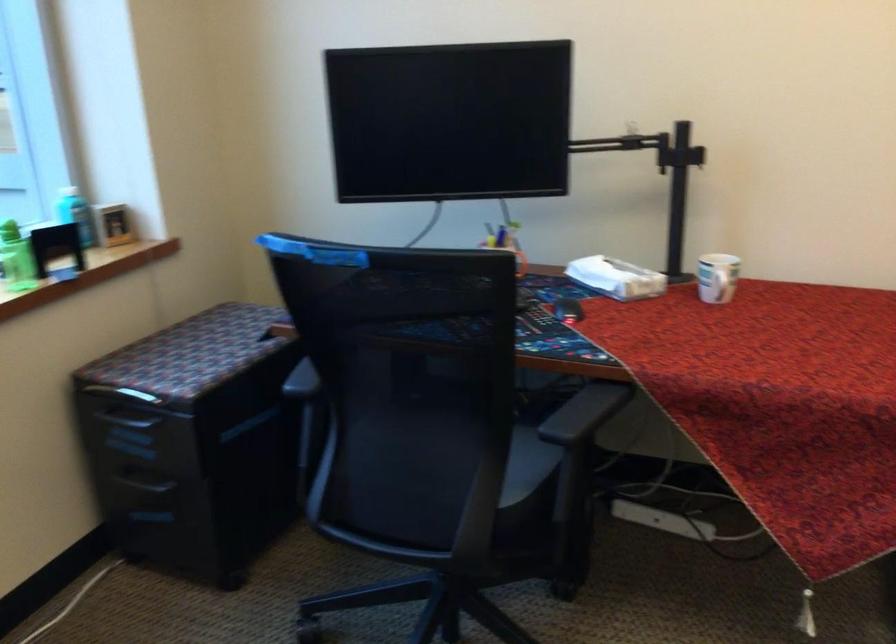
You are a GUI agent. You are given a task and a screenshot of the screen. Output one action in this format:
    pyautogui.click(x=<x>, y=<y>)
    Task: Click on the black chair armrest
    The width and height of the screenshot is (896, 644).
    Given the screenshot: What is the action you would take?
    pyautogui.click(x=302, y=380)